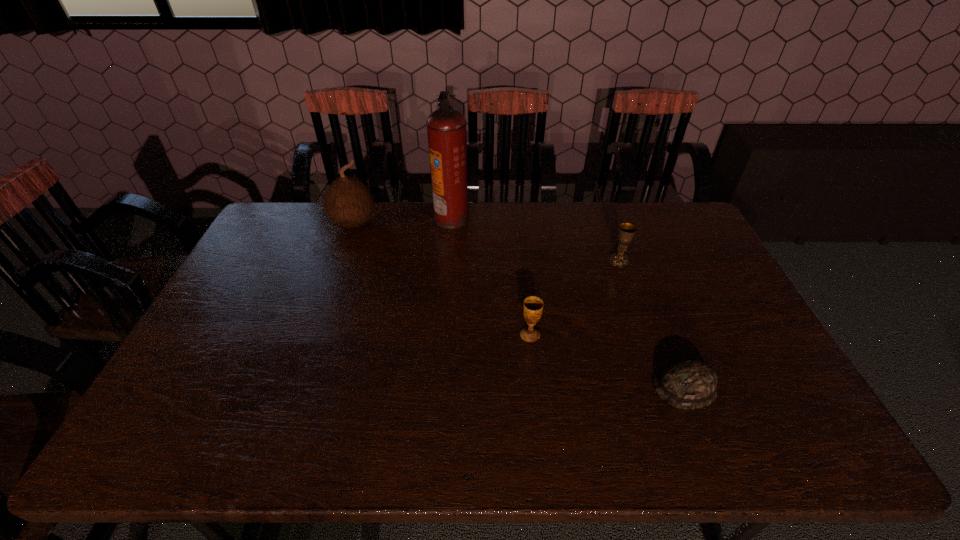
Locate an element on the screen. Image resolution: width=960 pixels, height=540 pixels. the tallest object is located at coordinates (446, 127).

Find the location of a particular element. the second object from left to right is located at coordinates (446, 127).

The width and height of the screenshot is (960, 540). What are the coordinates of `the fourth shortest object` in the screenshot? It's located at (348, 201).

What are the coordinates of `coconut` in the screenshot? It's located at (348, 201).

Where is `the third nearest object`? The width and height of the screenshot is (960, 540). the third nearest object is located at coordinates (626, 230).

Locate an element on the screen. The width and height of the screenshot is (960, 540). the farther chalice is located at coordinates (626, 230).

The height and width of the screenshot is (540, 960). Find the location of `the fourth farthest object`. the fourth farthest object is located at coordinates (533, 306).

You are a GUI agent. You are given a task and a screenshot of the screen. Output one action in this format:
    pyautogui.click(x=<x>, y=<y>)
    Task: Click on the left chalice
    The width and height of the screenshot is (960, 540).
    Given the screenshot: What is the action you would take?
    pyautogui.click(x=533, y=306)

The height and width of the screenshot is (540, 960). Find the location of `the shortest object`. the shortest object is located at coordinates (688, 383).

Locate an element on the screen. Image resolution: width=960 pixels, height=540 pixels. headwear is located at coordinates (688, 383).